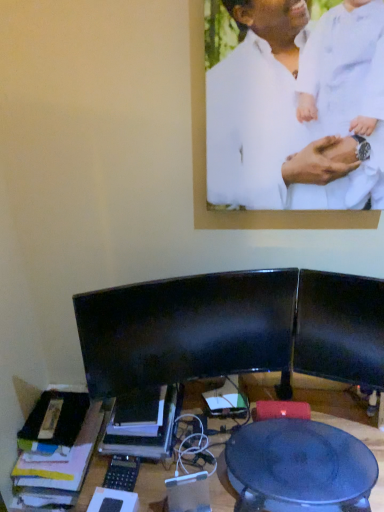
Question: Does matte black table at center lie behind white matte shirt at upper center?

Choices:
 (A) no
 (B) yes

Answer: (B)

Question: Does matte black table at center have a larger size compared to white matte shirt at upper center?

Choices:
 (A) yes
 (B) no

Answer: (A)

Question: Is matte black table at center far away from white matte shirt at upper center?

Choices:
 (A) yes
 (B) no

Answer: (B)

Question: Is white matte shirt at upper center at the back of matte black table at center?

Choices:
 (A) no
 (B) yes

Answer: (A)

Question: Does matte black table at center turn towards white matte shirt at upper center?

Choices:
 (A) no
 (B) yes

Answer: (A)

Question: From a real-world perspective, is matte black table at center located higher than white matte shirt at upper center?

Choices:
 (A) yes
 (B) no

Answer: (B)

Question: From the image's perspective, is matte black table at center beneath black glossy monitor at center?

Choices:
 (A) yes
 (B) no

Answer: (A)

Question: Could you tell me if matte black table at center is facing black glossy monitor at center?

Choices:
 (A) yes
 (B) no

Answer: (B)

Question: Is matte black table at center positioned beyond the bounds of black glossy monitor at center?

Choices:
 (A) yes
 (B) no

Answer: (A)

Question: Is there a large distance between matte black table at center and black glossy monitor at center?

Choices:
 (A) yes
 (B) no

Answer: (B)

Question: Does matte black table at center appear on the left side of black glossy monitor at center?

Choices:
 (A) no
 (B) yes

Answer: (A)

Question: Does matte black table at center have a smaller size compared to black glossy monitor at center?

Choices:
 (A) yes
 (B) no

Answer: (B)

Question: Can you confirm if black glossy monitor at center is wider than matte black table at center?

Choices:
 (A) yes
 (B) no

Answer: (B)